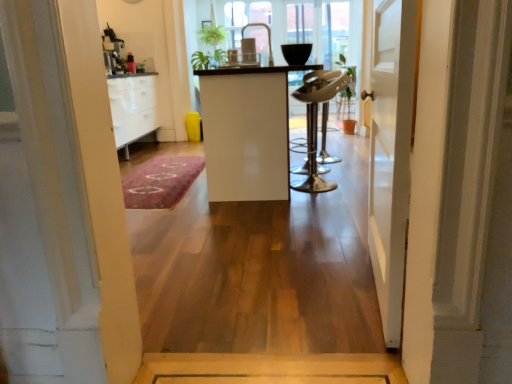
Question: Is shiny metallic bar stool at center spatially inside pink carpet at center, or outside of it?

Choices:
 (A) outside
 (B) inside

Answer: (A)

Question: Visually, is shiny metallic bar stool at center positioned to the left or to the right of pink carpet at center?

Choices:
 (A) right
 (B) left

Answer: (A)

Question: Which of these objects is positioned farthest from the shiny metallic bar stool at center?

Choices:
 (A) white glossy cabinet at center
 (B) pink carpet at center
 (C) white wooden door at center

Answer: (C)

Question: Which is nearer to the white wooden door at center?

Choices:
 (A) pink carpet at center
 (B) shiny metallic bar stool at center
 (C) white glossy cabinet at center

Answer: (C)